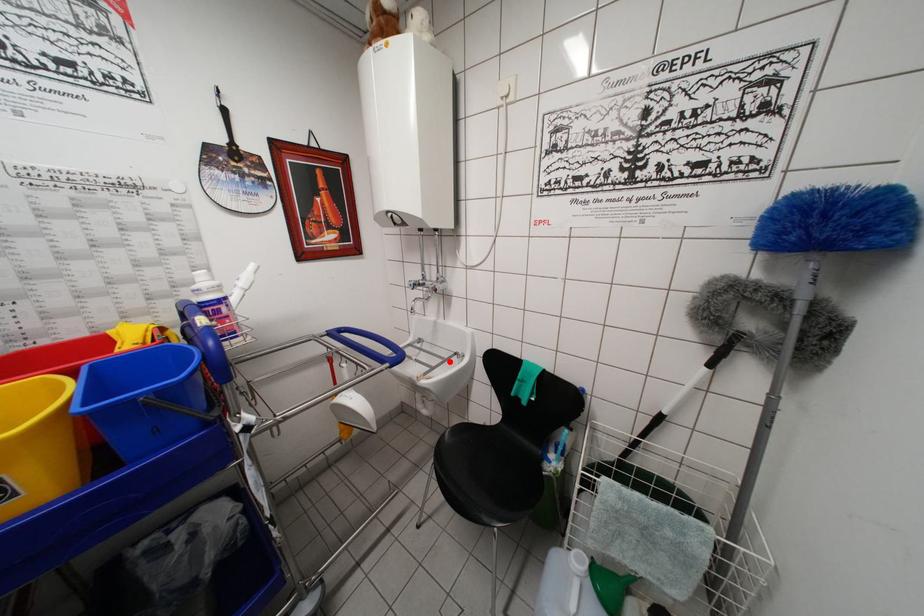
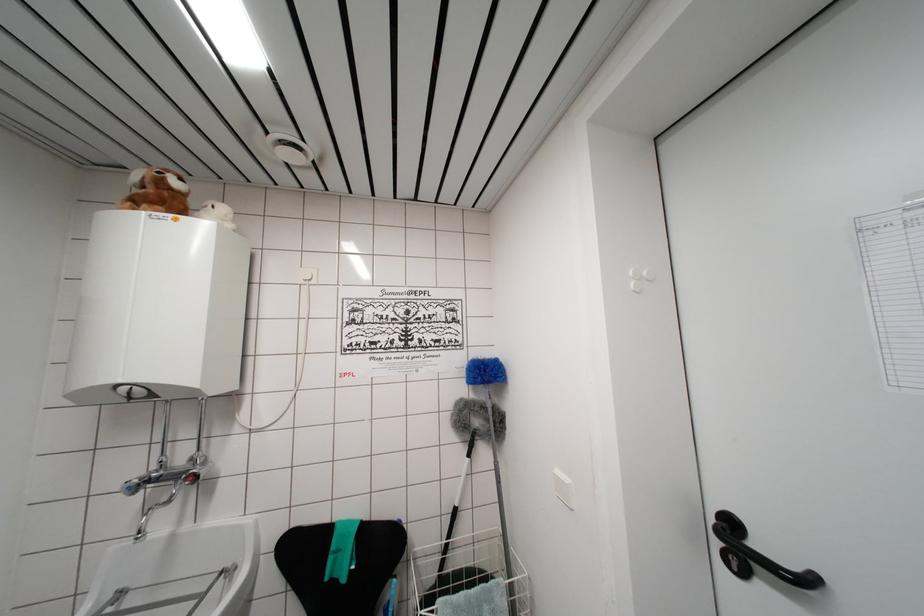
Where in the second image is the point corresponding to the highlighted location from the first image?

(209, 593)